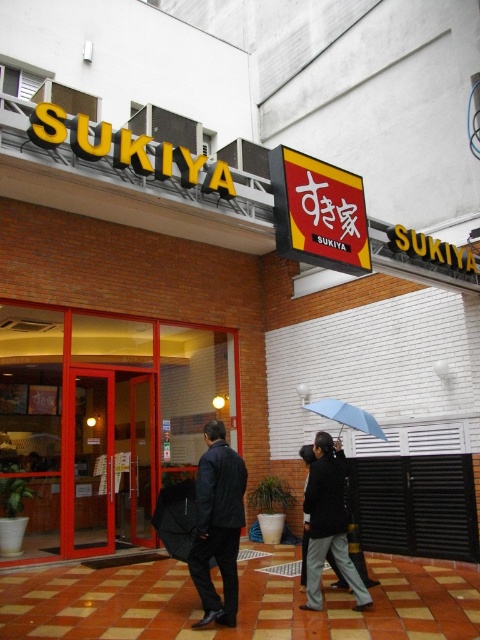
You are standing at the entrance of the restaurant and want to take a photo of the point at coordinate (314, 518). The camera you are using has a focal length of 50mm and a sensor size of 24mm x 36mm. What is the minimum distance you need to move forward to ensure the point fills the frame vertically?

The point at coordinate (314, 518) is 17.31 feet away from the camera. To calculate the minimum distance needed to fill the frame vertically, use the formula distance_new_distance_old multiplied by sensor height divided by desired height. However, since the point is a single coordinate, it cannot fill the frame vertically. Therefore, you cannot take such a photo as the point has no dimension.

You are a customer waiting at the entrance of the restaurant. You see a dark blue jacket at center and a blue matte umbrella at center. Which item is larger in size?

The dark blue jacket at center is bigger than the blue matte umbrella at center.